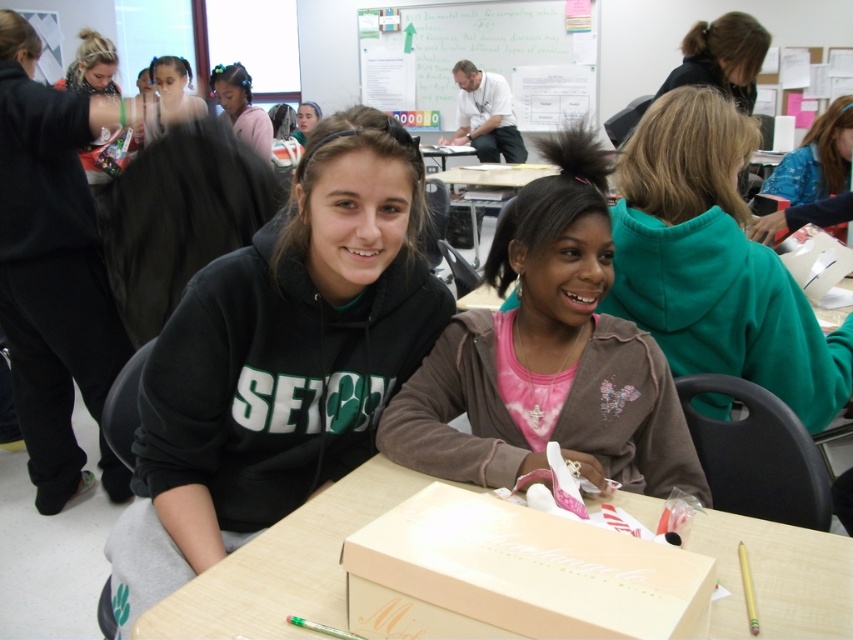
Locate an element on the screen. The height and width of the screenshot is (640, 853). black hoodie at upper left is located at coordinates (51, 262).

Between black hoodie at upper left and matte black hoodie at upper left, which one has more height?

Standing taller between the two is black hoodie at upper left.

Which is in front, point (64, 484) or point (143, 140)?

Point (64, 484)

In order to click on black hoodie at upper left in this screenshot , I will do `click(51, 262)`.

Who is lower down, black matte hoodie at center or brown fleece jacket at center?

black matte hoodie at center

Which of these two, black matte hoodie at center or brown fleece jacket at center, stands taller?

black matte hoodie at center is taller.

Locate an element on the screen. This screenshot has width=853, height=640. black matte hoodie at center is located at coordinates (279, 360).

The width and height of the screenshot is (853, 640). Find the location of `brown fleece jacket at center`. brown fleece jacket at center is located at coordinates (547, 356).

Who is more distant from viewer, [602,285] or [421,570]?

Point [602,285]

This screenshot has width=853, height=640. In order to click on brown fleece jacket at center in this screenshot , I will do `click(547, 356)`.

Find the location of a particular element. Image resolution: width=853 pixels, height=640 pixels. brown fleece jacket at center is located at coordinates (547, 356).